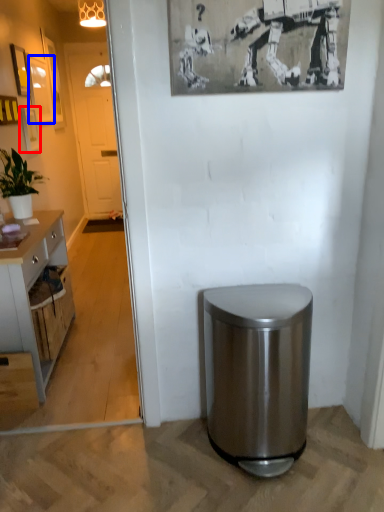
Question: Among these objects, which one is farthest to the camera, picture frame (highlighted by a red box) or picture frame (highlighted by a blue box)?

Choices:
 (A) picture frame
 (B) picture frame

Answer: (B)